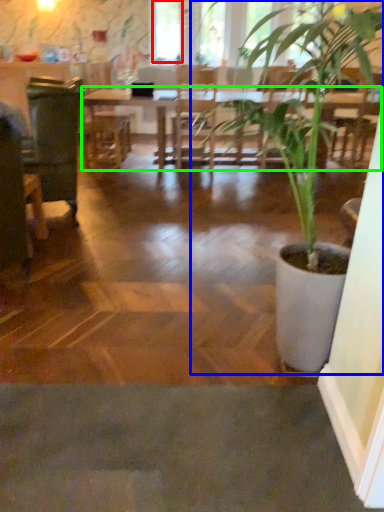
Question: Considering the real-world distances, which object is farthest from window screen (highlighted by a red box)? houseplant (highlighted by a blue box) or table (highlighted by a green box)?

Choices:
 (A) houseplant
 (B) table

Answer: (A)